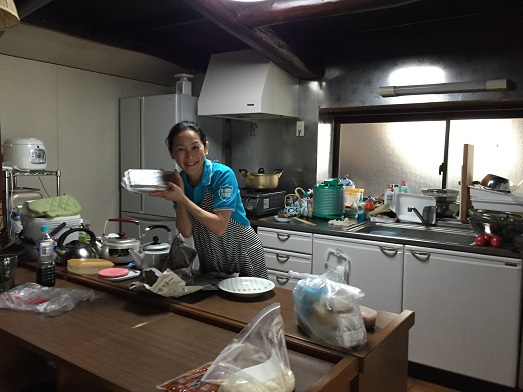
Locate an element on the screen. The image size is (523, 392). cutting board is located at coordinates (468, 161).